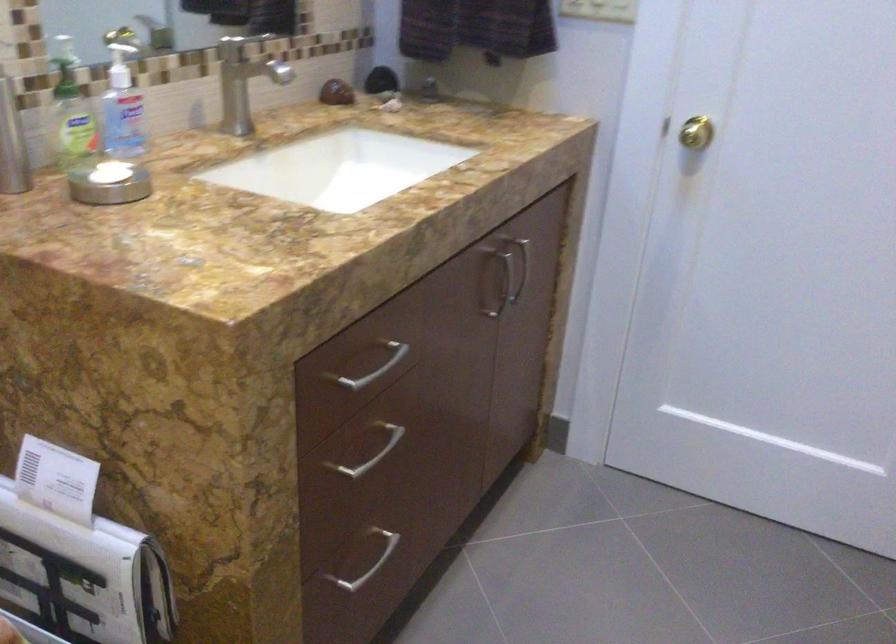
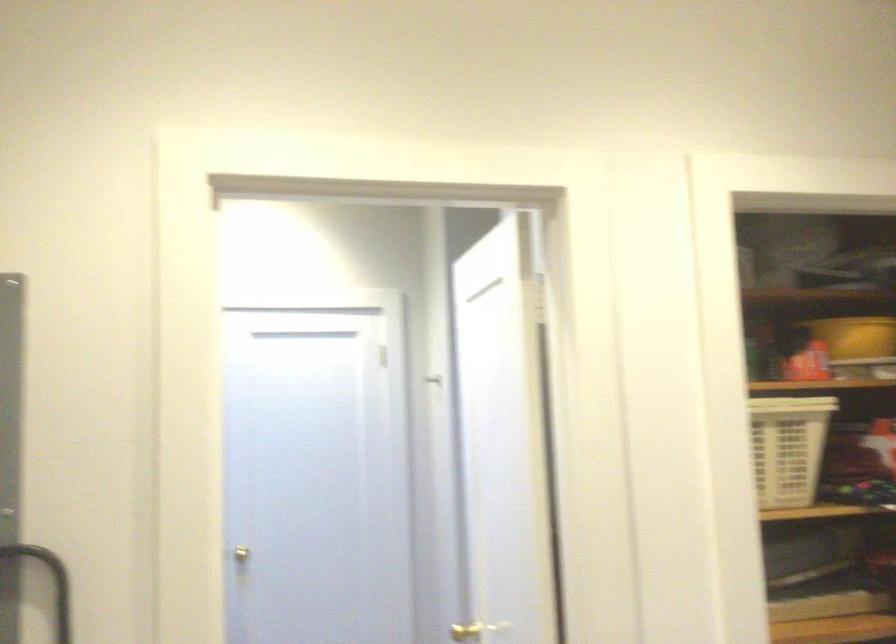
The point at (x=710, y=131) is marked in the first image. Where is the corresponding point in the second image?

(253, 553)